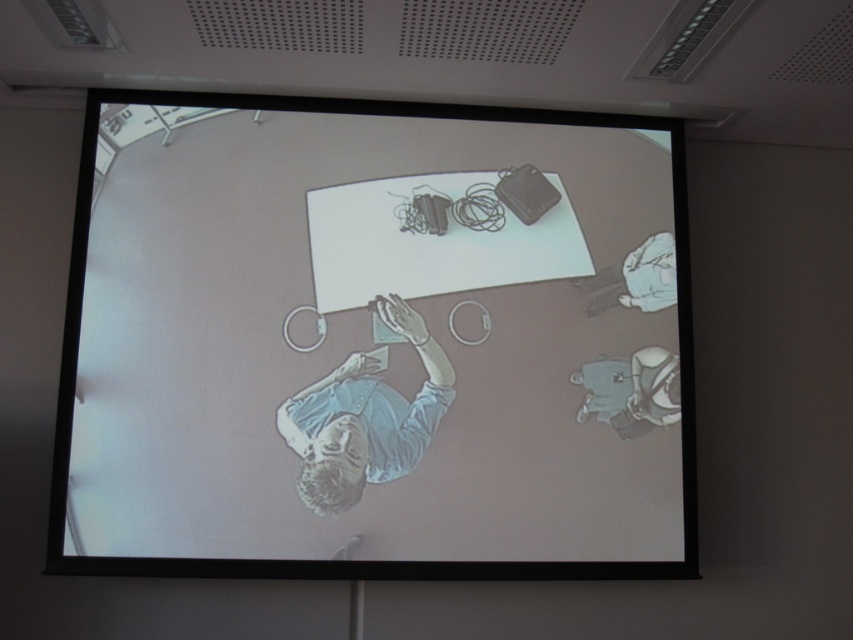
You are standing in the meeting room looking at the projection screen. There are two points marked on the screen at coordinates point (186,298) and point (643,355). Which point is closer to you?

Point (186,298) is closer to the viewer than point (643,355).